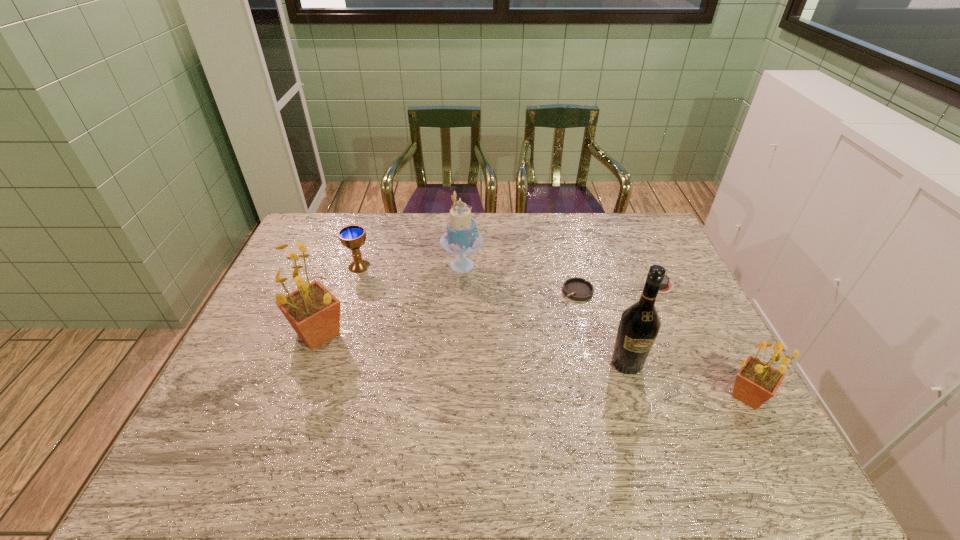
I want to click on free space that satisfies the following two spatial constraints: 1. with a ladder on the side of the cake; 2. on the left side of the chocolate cake, so click(x=461, y=284).